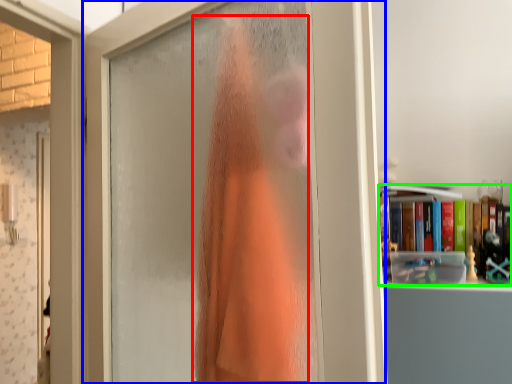
Question: Which object is positioned closest to clothing (highlighted by a red box)? Select from door (highlighted by a blue box) and book (highlighted by a green box).

Choices:
 (A) door
 (B) book

Answer: (A)